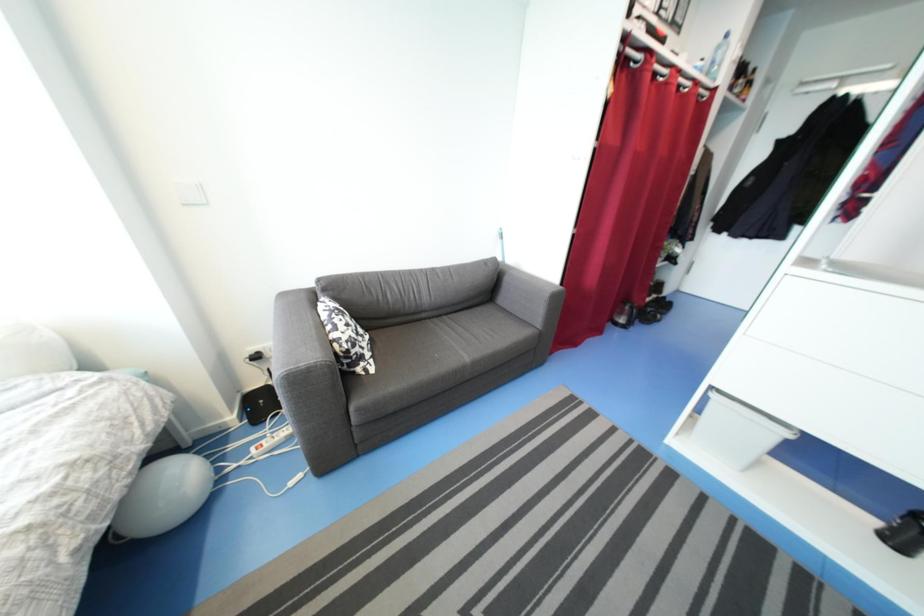
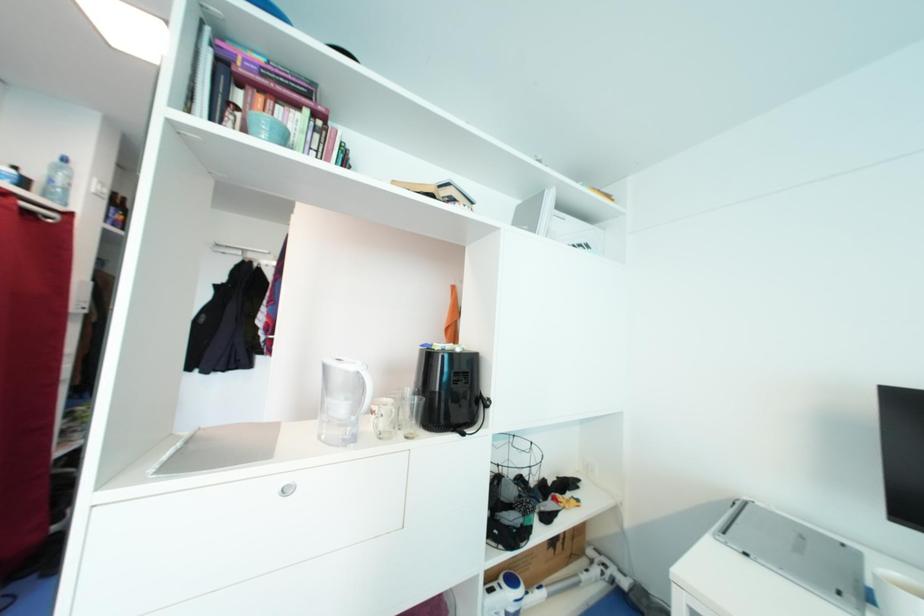
Question: The camera is either moving clockwise (left) or counter-clockwise (right) around the object. The first image is from the beginning of the video and the second image is from the end. Is the camera moving left or right when shooting the video?

Choices:
 (A) Left
 (B) Right

Answer: (A)